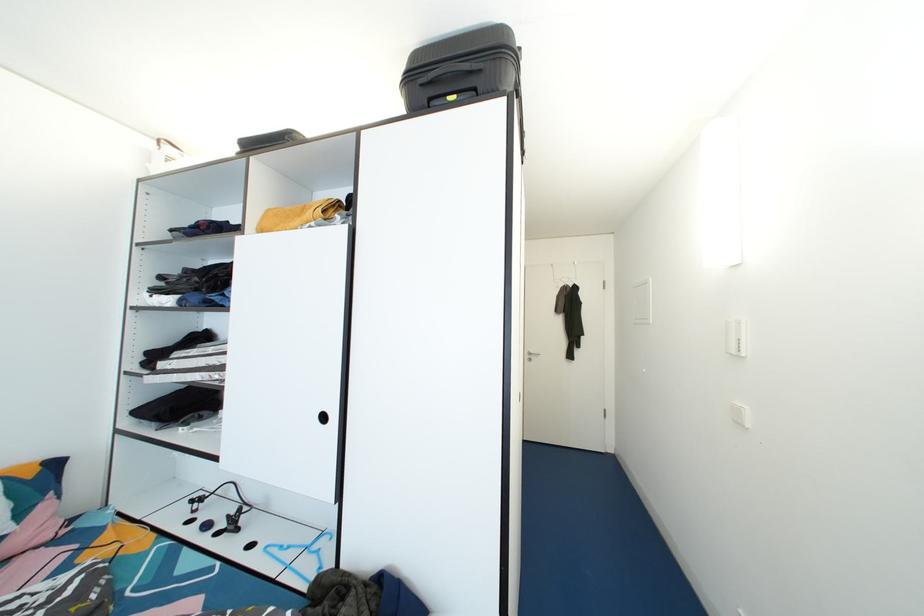
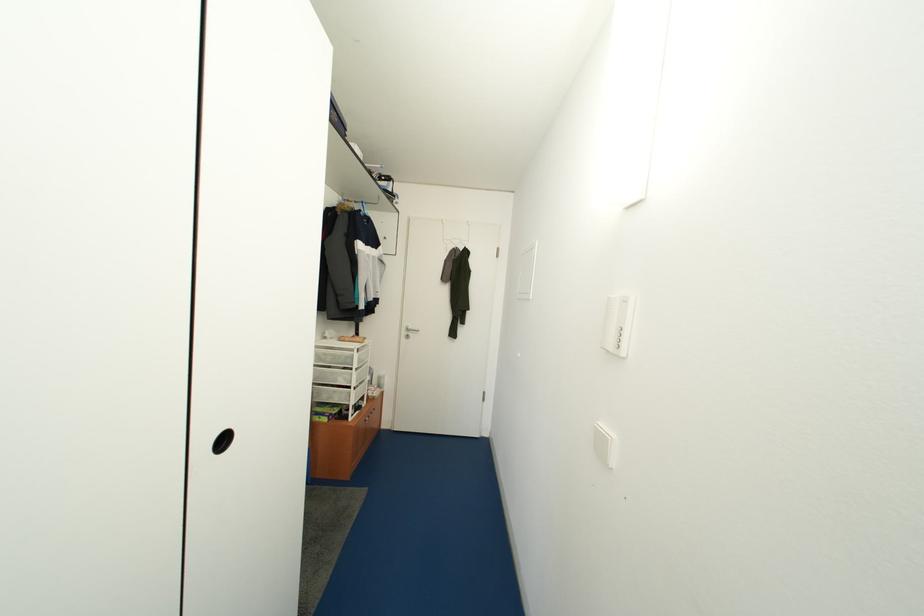
Question: The camera is either moving clockwise (left) or counter-clockwise (right) around the object. The first image is from the beginning of the video and the second image is from the end. Is the camera moving left or right when shooting the video?

Choices:
 (A) Left
 (B) Right

Answer: (A)